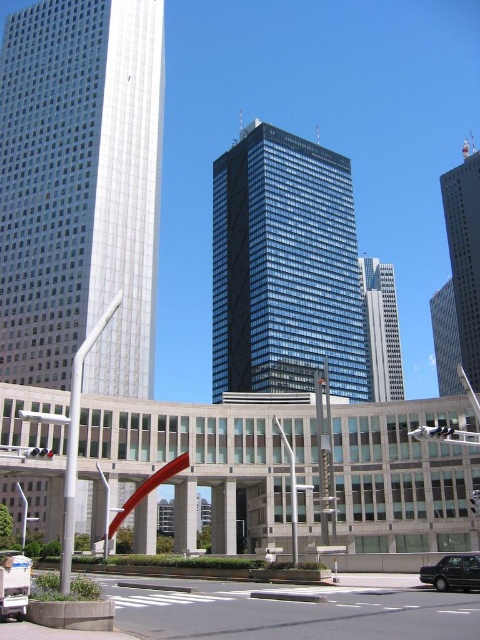
The height and width of the screenshot is (640, 480). Describe the element at coordinates (458, 278) in the screenshot. I see `glassy reflective skyscraper at right` at that location.

Does glassy reflective skyscraper at right have a greater height compared to black glossy sedan at lower right?

Correct, glassy reflective skyscraper at right is much taller as black glossy sedan at lower right.

The width and height of the screenshot is (480, 640). In order to click on glassy reflective skyscraper at right in this screenshot , I will do `click(458, 278)`.

Is glassy steel skyscraper at center bigger than black glossy sedan at lower right?

Indeed, glassy steel skyscraper at center has a larger size compared to black glossy sedan at lower right.

Does point (389, 326) come behind point (462, 570)?

Yes.

Between point (395, 380) and point (453, 564), which one is positioned behind?

Point (395, 380)

The width and height of the screenshot is (480, 640). I want to click on glassy steel skyscraper at center, so click(382, 330).

Is silver glass skyscraper at left positioned before glassy reflective skyscraper at right?

That is True.

Which is more to the right, silver glass skyscraper at left or glassy reflective skyscraper at right?

glassy reflective skyscraper at right is more to the right.

Is point (14, 154) farther from viewer compared to point (443, 204)?

That is False.

This screenshot has height=640, width=480. Find the location of `silver glass skyscraper at left`. silver glass skyscraper at left is located at coordinates (80, 189).